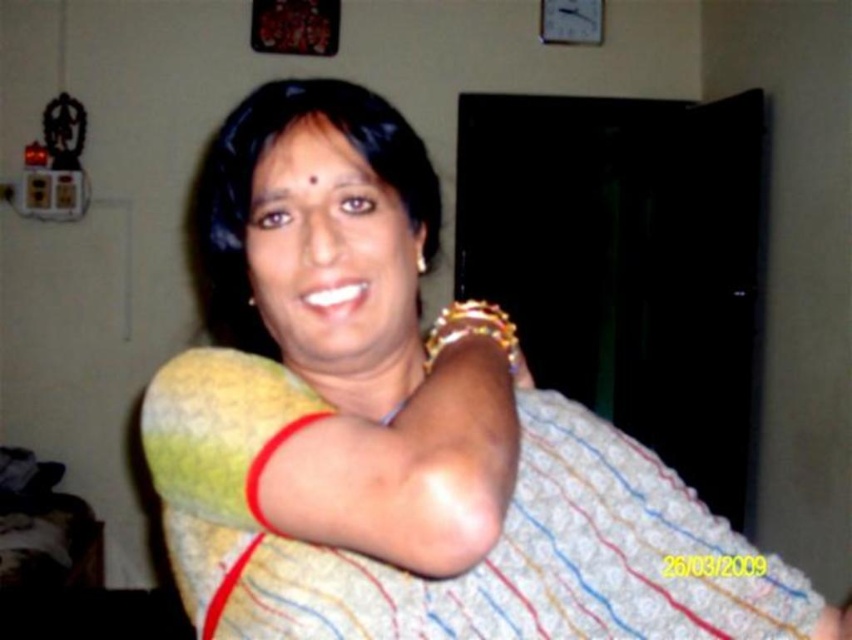
You are a guest at a cultural event and notice the yellow fabric at center and the gold shiny bracelet at upper right. Which object is located lower in the image?

The yellow fabric at center is positioned under gold shiny bracelet at upper right, so the yellow fabric at center is located lower in the image.

You are an interior designer looking at the image of a person in a colorful sari. You need to describe the spatial relationship between the yellow fabric at center and the gold shiny bracelet at upper right. Which object is positioned to the left of the other?

The yellow fabric at center is positioned to the left of gold shiny bracelet at upper right.